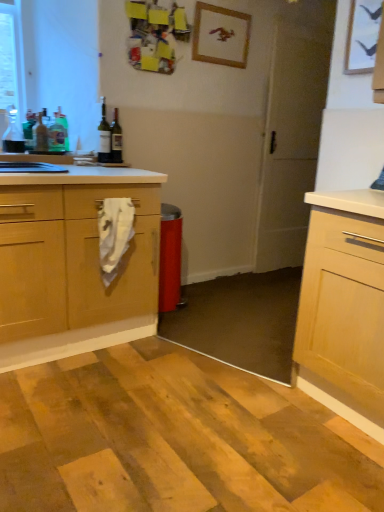
Question: Considering the relative sizes of white matte screen door at center and white fabric towel at center in the image provided, is white matte screen door at center shorter than white fabric towel at center?

Choices:
 (A) no
 (B) yes

Answer: (A)

Question: From a real-world perspective, is white matte screen door at center located higher than white fabric towel at center?

Choices:
 (A) no
 (B) yes

Answer: (B)

Question: Considering the relative sizes of white matte screen door at center and white fabric towel at center in the image provided, is white matte screen door at center bigger than white fabric towel at center?

Choices:
 (A) no
 (B) yes

Answer: (B)

Question: Does white matte screen door at center have a lesser width compared to white fabric towel at center?

Choices:
 (A) no
 (B) yes

Answer: (A)

Question: Considering the relative sizes of white matte screen door at center and white fabric towel at center in the image provided, is white matte screen door at center taller than white fabric towel at center?

Choices:
 (A) no
 (B) yes

Answer: (B)

Question: Is white matte screen door at center smaller than white fabric towel at center?

Choices:
 (A) no
 (B) yes

Answer: (A)

Question: Is green glass bottle at left, the fourth bottle viewed from the left, at the back of matte glass bottle at upper left, marked as the 5th bottle in a left-to-right arrangement?

Choices:
 (A) yes
 (B) no

Answer: (B)

Question: Does matte glass bottle at upper left, marked as the 5th bottle in a left-to-right arrangement, lie in front of green glass bottle at left, which is the 3th bottle from right to left?

Choices:
 (A) yes
 (B) no

Answer: (A)

Question: Could you tell me if matte glass bottle at upper left, marked as the 5th bottle in a left-to-right arrangement, is turned towards green glass bottle at left, the fourth bottle viewed from the left?

Choices:
 (A) no
 (B) yes

Answer: (A)

Question: From a real-world perspective, is matte glass bottle at upper left, the 2th bottle viewed from the right, beneath green glass bottle at left, the fourth bottle viewed from the left?

Choices:
 (A) yes
 (B) no

Answer: (B)

Question: Is green glass bottle at left, which is the 3th bottle from right to left, surrounded by matte glass bottle at upper left, marked as the 5th bottle in a left-to-right arrangement?

Choices:
 (A) no
 (B) yes

Answer: (A)

Question: Does matte glass bottle at upper left, the 2th bottle viewed from the right, have a lesser width compared to green glass bottle at left, the fourth bottle viewed from the left?

Choices:
 (A) yes
 (B) no

Answer: (B)

Question: Can you confirm if green glass bottle at upper left, which ranks as the sixth bottle in left-to-right order, is bigger than green glass bottle at upper left, the 4th bottle positioned from the right?

Choices:
 (A) no
 (B) yes

Answer: (A)